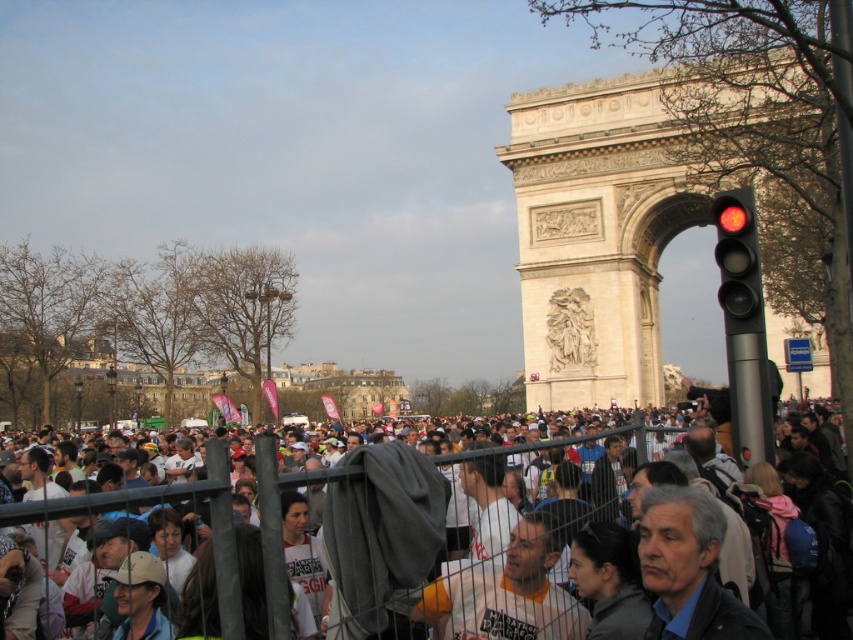
You are standing at the Arc de Triomphe and want to take a photo of the point at coordinates (x=265, y=518). If your camera has a maximum zoom range of 50 meters, will you be able to capture the point clearly?

The distance of point (x=265, y=518) from viewer is 66.45 meters, so the camera with a maximum zoom range of 50 meters cannot capture the point clearly as it is beyond the zoom limit.